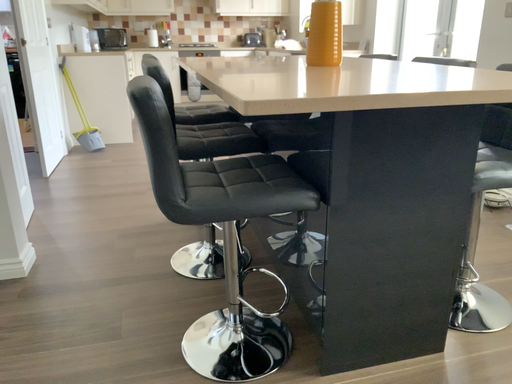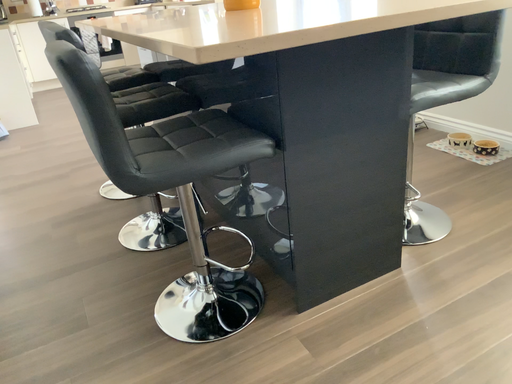
Question: Which way did the camera rotate in the video?

Choices:
 (A) rotated left
 (B) rotated right

Answer: (B)